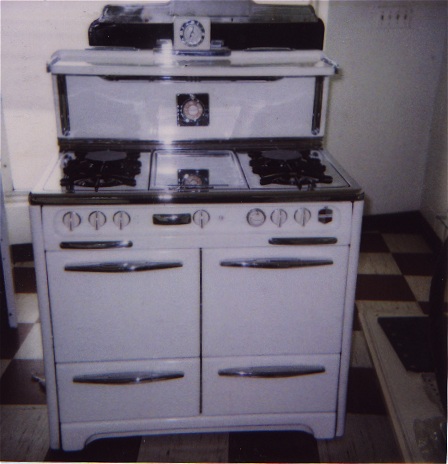
I want to click on floor, so click(196, 450), click(23, 324), click(396, 267).